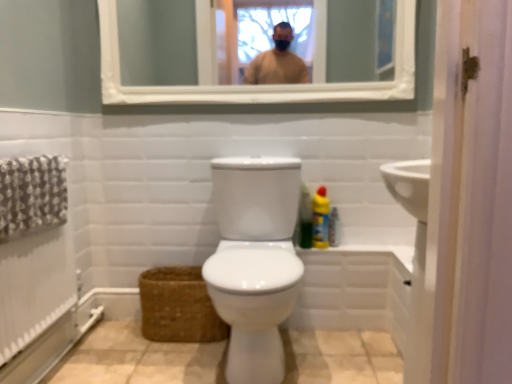
Question: Considering the positions of white glossy bidet at center and white wooden mirror at upper center in the image, is white glossy bidet at center taller or shorter than white wooden mirror at upper center?

Choices:
 (A) tall
 (B) short

Answer: (A)

Question: Relative to white wooden mirror at upper center, is white glossy bidet at center in front or behind?

Choices:
 (A) behind
 (B) front

Answer: (B)

Question: Based on their relative distances, which object is farther from the brown woven basket at lower left?

Choices:
 (A) translucent plastic spray bottle at right
 (B) white glossy bidet at center
 (C) yellow plastic bottle at right, which appears as the 2th cleaning product when viewed from the left
 (D) green matte bottle at right, arranged as the first cleaning product when viewed from the left
 (E) white wooden mirror at upper center

Answer: (E)

Question: Estimate the real-world distances between objects in this image. Which object is closer to the translucent plastic spray bottle at right?

Choices:
 (A) green matte bottle at right, arranged as the second cleaning product when viewed from the right
 (B) brown woven basket at lower left
 (C) yellow plastic bottle at right, which appears as the 2th cleaning product when viewed from the left
 (D) white wooden mirror at upper center
 (E) white glossy bidet at center

Answer: (C)